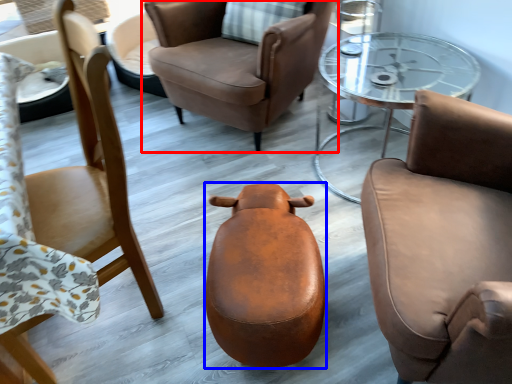
Question: Among these objects, which one is nearest to the camera, chair (highlighted by a red box) or stool (highlighted by a blue box)?

Choices:
 (A) chair
 (B) stool

Answer: (B)